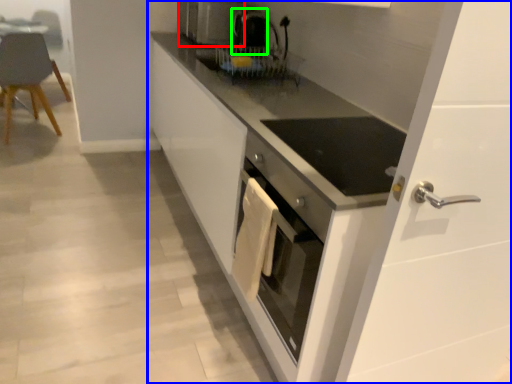
Question: Considering the real-world distances, which object is farthest from home appliance (highlighted by a red box)? cabinetry (highlighted by a blue box) or coffee machine (highlighted by a green box)?

Choices:
 (A) cabinetry
 (B) coffee machine

Answer: (A)